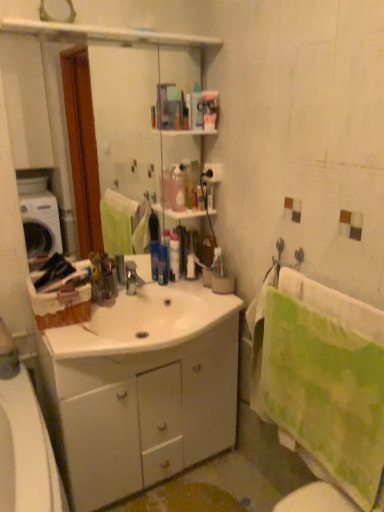
Locate an element on the screen. The height and width of the screenshot is (512, 384). vacant space in front of translucent plastic bottle at center, which is the third toiletry in right-to-left order is located at coordinates (173, 302).